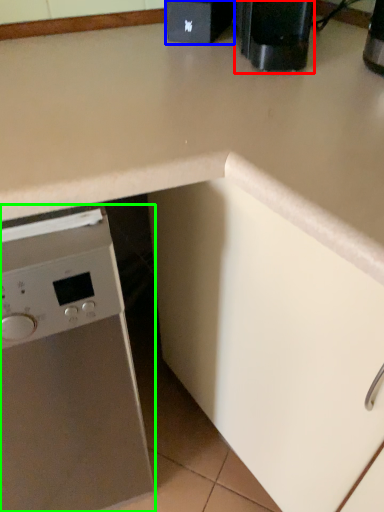
Question: Based on their relative distances, which object is farther from coffee machine (highlighted by a red box)? Choose from appliance (highlighted by a blue box) and home appliance (highlighted by a green box).

Choices:
 (A) appliance
 (B) home appliance

Answer: (B)